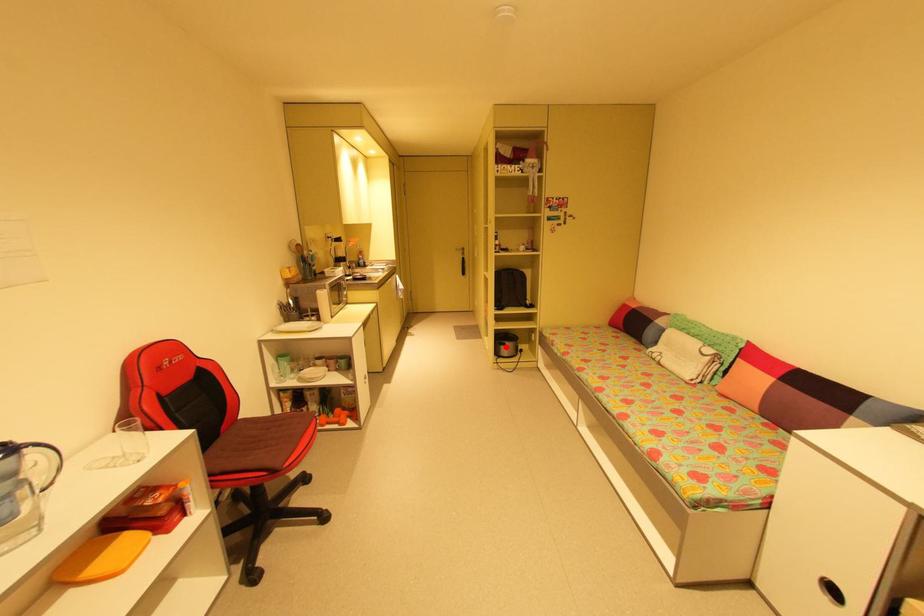
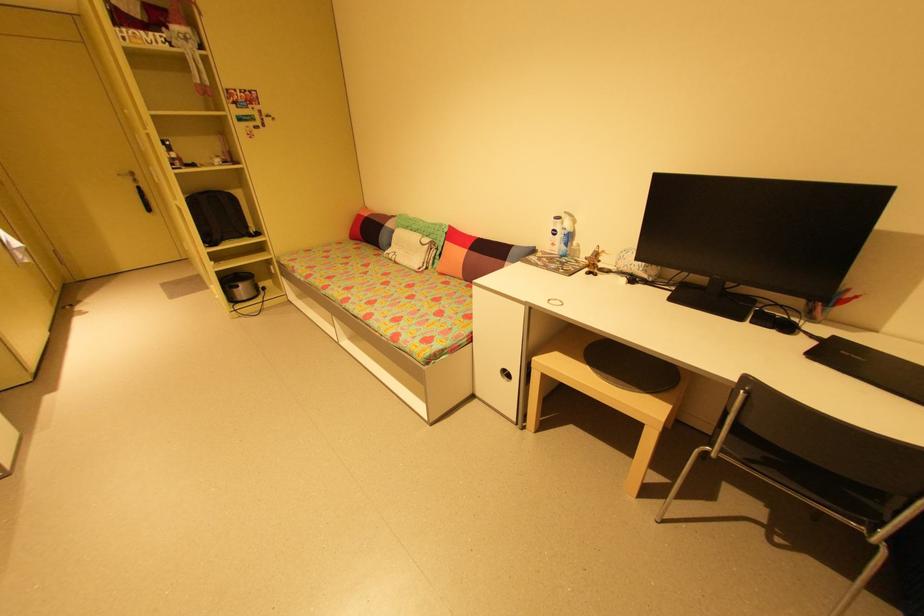
In the second image, find the point that corresponds to the highlighted location in the first image.

(239, 291)